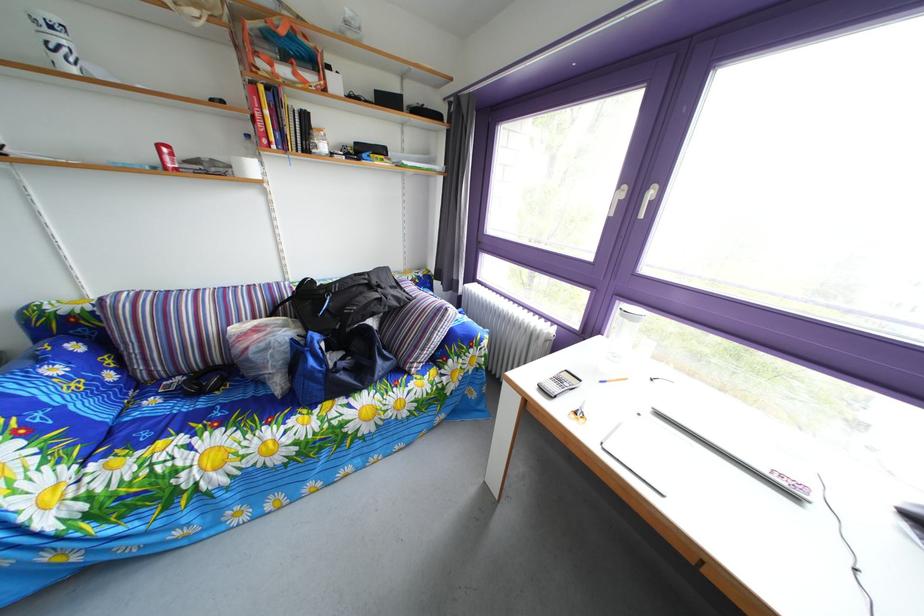
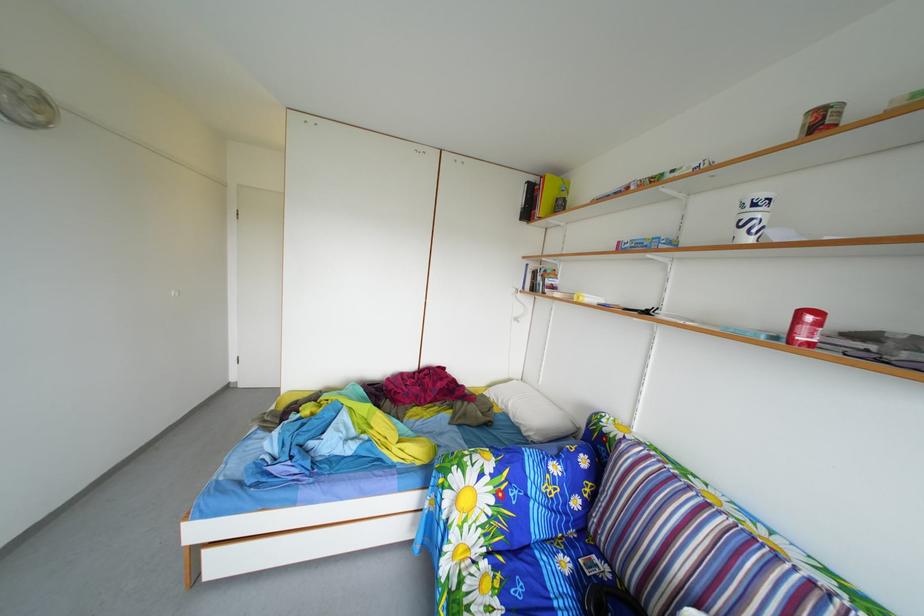
Question: The first image is from the beginning of the video and the second image is from the end. How did the camera likely rotate when shooting the video?

Choices:
 (A) Left
 (B) Right
 (C) Up
 (D) Down

Answer: (A)